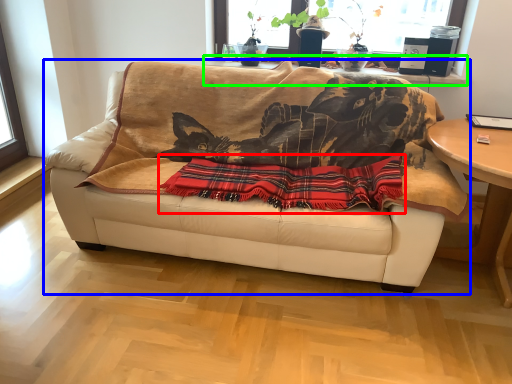
Question: Based on their relative distances, which object is farther from plaid (highlighted by a red box)? Choose from studio couch (highlighted by a blue box) and window sill (highlighted by a green box).

Choices:
 (A) studio couch
 (B) window sill

Answer: (B)